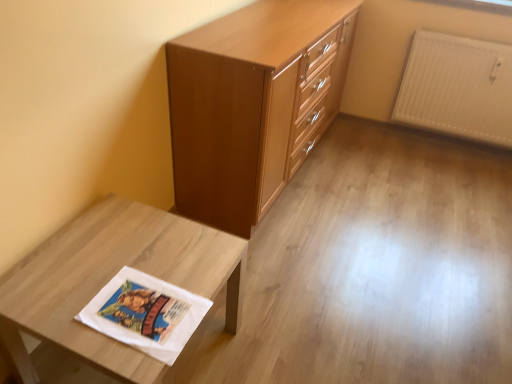
Locate an element on the screen. The image size is (512, 384). vacant space in between white matte fabric at lower left and white textured radiator at upper right is located at coordinates (362, 219).